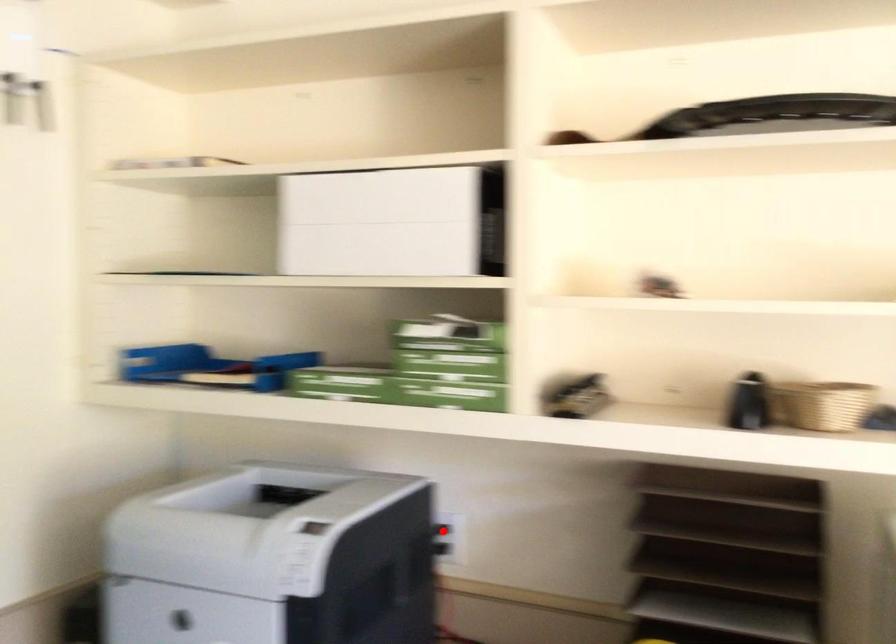
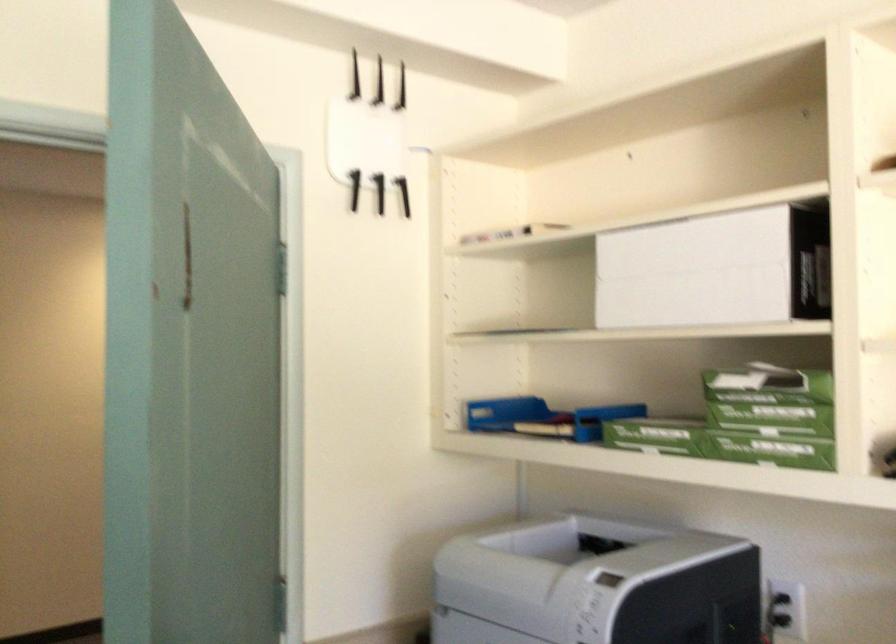
In the second image, find the point that corresponds to the highlighted location in the first image.

(782, 609)